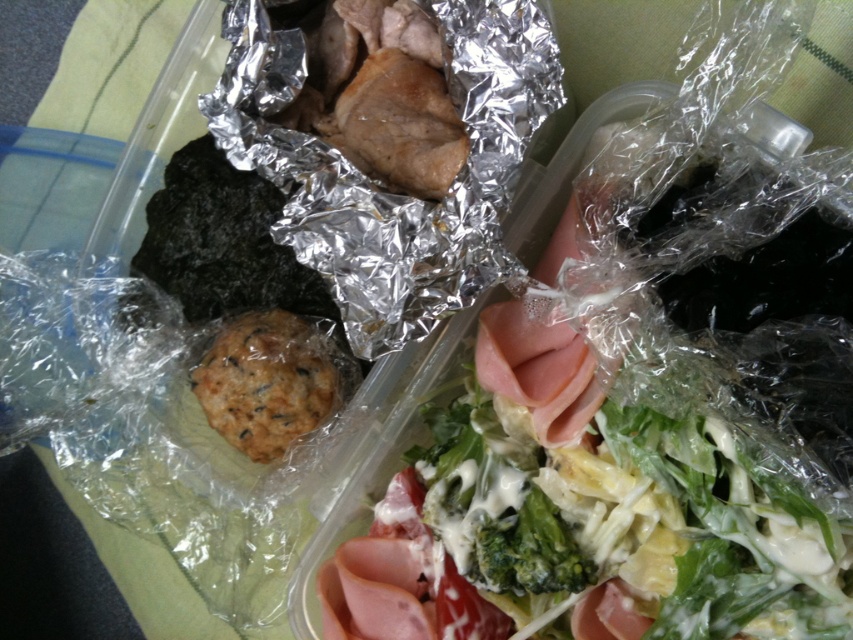
Is green leafy salad at upper right positioned in front of green matte broccoli at center?

Yes, green leafy salad at upper right is closer to the viewer.

Which is more to the right, green leafy salad at upper right or green matte broccoli at center?

green leafy salad at upper right

Locate an element on the screen. This screenshot has height=640, width=853. green leafy salad at upper right is located at coordinates (602, 486).

This screenshot has height=640, width=853. I want to click on green leafy salad at upper right, so click(x=602, y=486).